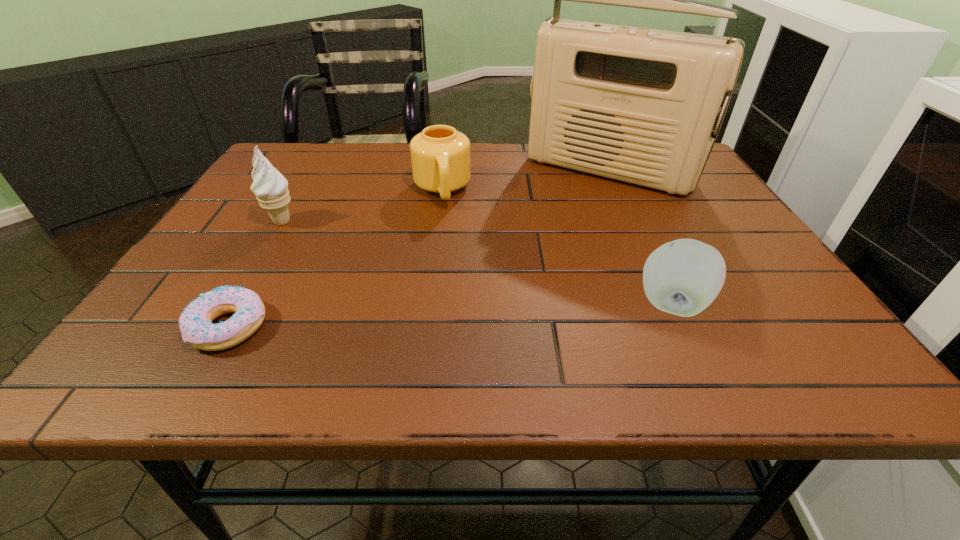
What are the coordinates of `free spot between the icecream and the third object from right to left` in the screenshot? It's located at [x=362, y=206].

This screenshot has height=540, width=960. In order to click on object that is the second closest one to the mug in this screenshot , I will do `click(270, 187)`.

Identify which object is the fourth nearest to the tallest object. Please provide its 2D coordinates. Your answer should be formatted as a tuple, i.e. [(x, y)], where the tuple contains the x and y coordinates of a point satisfying the conditions above.

[(195, 323)]